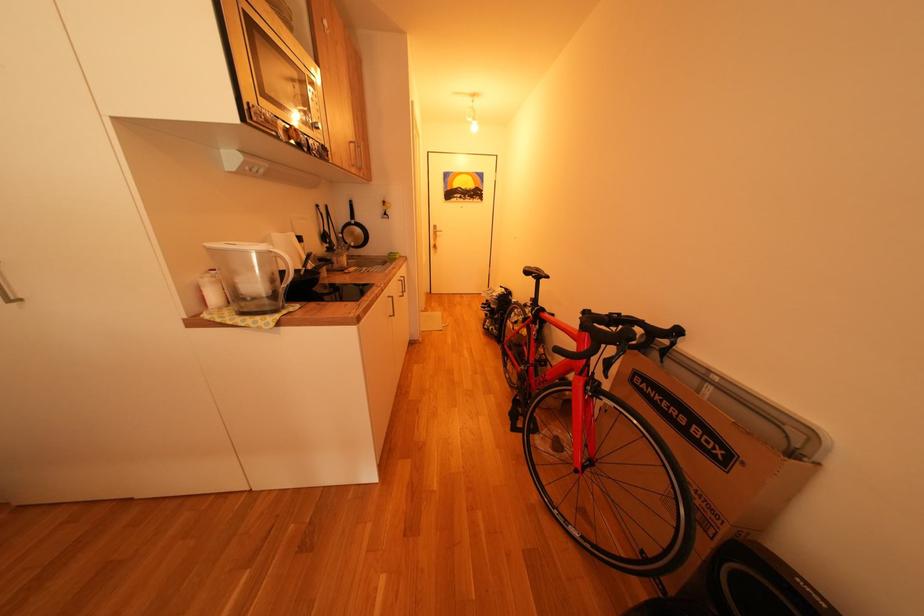
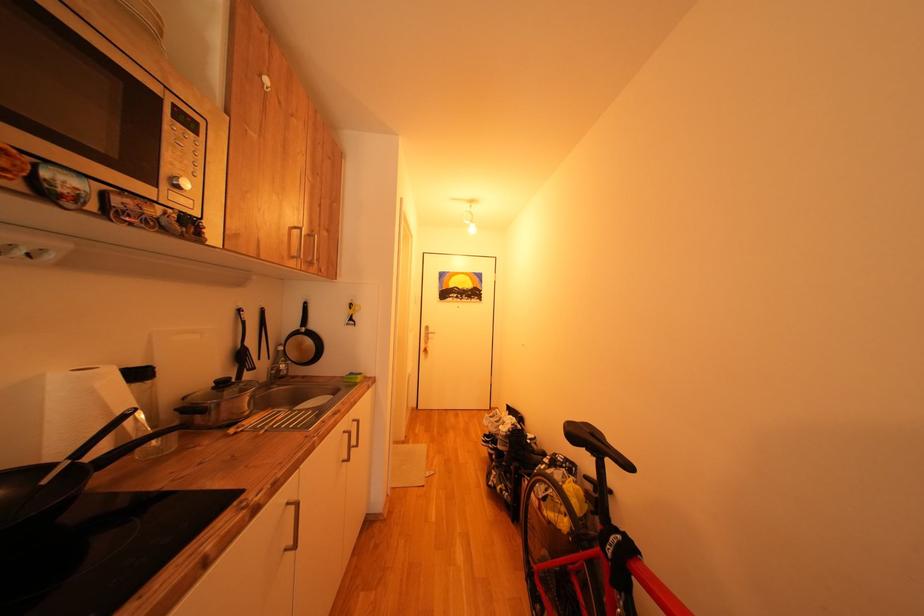
Question: The images are taken continuously from a first-person perspective. In which direction are you moving?

Choices:
 (A) Left
 (B) Right
 (C) Forward
 (D) Backward

Answer: (C)